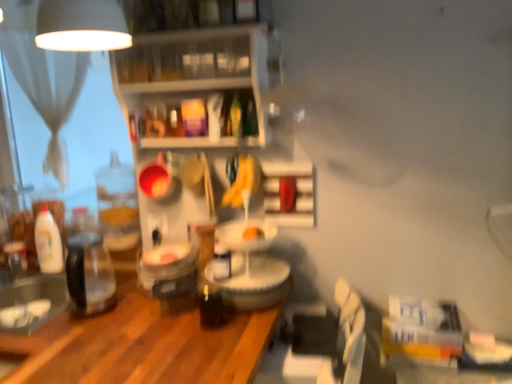
What are the coordinates of `vacant space to the right of clear glass jar at left` in the screenshot? It's located at (133, 317).